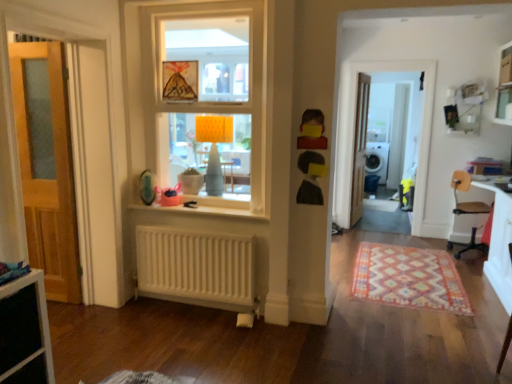
This screenshot has width=512, height=384. What are the coordinates of `vacant space that is to the left of white matte radiator at lower center` in the screenshot? It's located at pos(137,316).